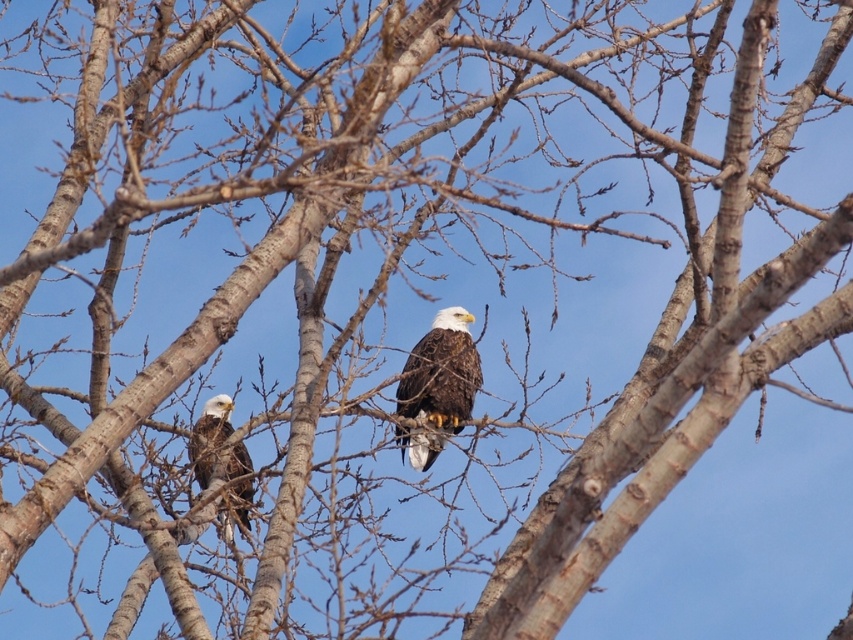
You are a wildlife photographer trying to capture a clear photo of the brown feathered eagle at center and the dark brown feathers at center. Which one should you focus on first to ensure it appears larger in your photo?

The brown feathered eagle at center is bigger than the dark brown feathers at center, so you should focus on the brown feathered eagle at center first to ensure it appears larger in your photo.

You are an ornithologist observing two bald eagles in a tree. You notice two points marked on the image, point A at coordinates point (433, 344) and point B at coordinates point (206, 436). Which point is closer to you?

Point A at coordinates point (433, 344) is closer to you because it is further to the viewer than point B at coordinates point (206, 436).

Two bald eagles are perched on a tree branch. The first is at point [439,362] and the second is at point 0.434, 0.484. The distance between them is 39.05 feet. If a bird watcher wants to observe both eagles through a telescope with a 20 feet field of view, will they need to adjust the telescope to see both eagles at the same time?

The distance between the two bald eagles is 39.05 feet, which is greater than the telescope field of view of 20 feet. Therefore, the bird watcher will need to adjust the telescope to see both eagles at the same time.